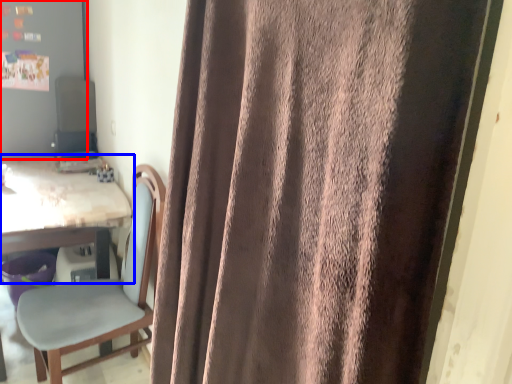
Question: Which of the following is the closest to the observer, bulletin board (highlighted by a red box) or table (highlighted by a blue box)?

Choices:
 (A) bulletin board
 (B) table

Answer: (B)